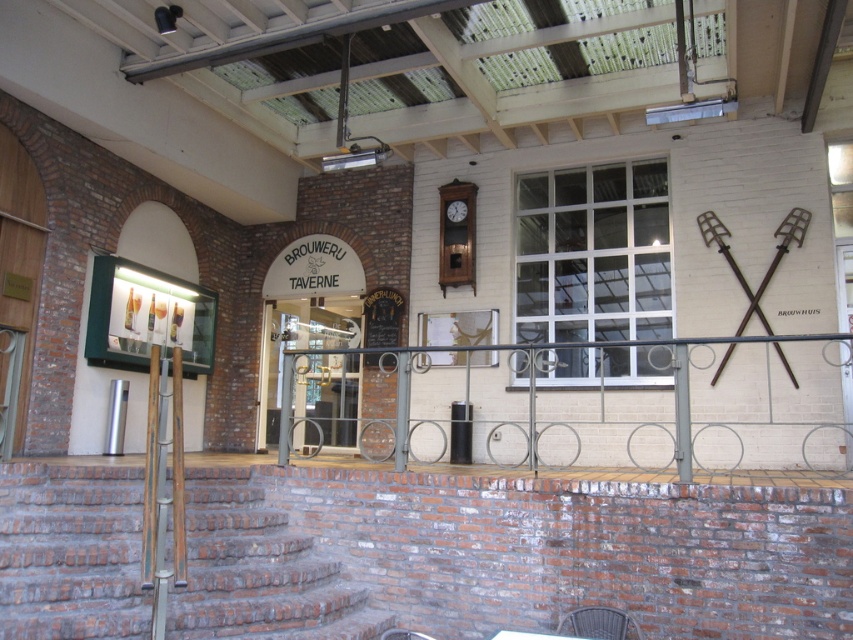
You are standing at the entrance of Brouwerij Tavernne and want to reach the metallic gray railing at center. According to the image, in which direction should you move from the entrance to find the railing?

The metallic gray railing at center is located at point coordinates that are to the right and slightly below the entrance, so you should move towards the right side of the entrance to reach it.

Looking at this image, you are standing in front of the Brouwerij Tavernne building and want to locate both the metallic gray railing at center and the wooden clock at center. According to the scene, which object is positioned to the right of the other?

The metallic gray railing at center is positioned on the right side of wooden clock at center, so the metallic gray railing at center is to the right of the wooden clock at center.